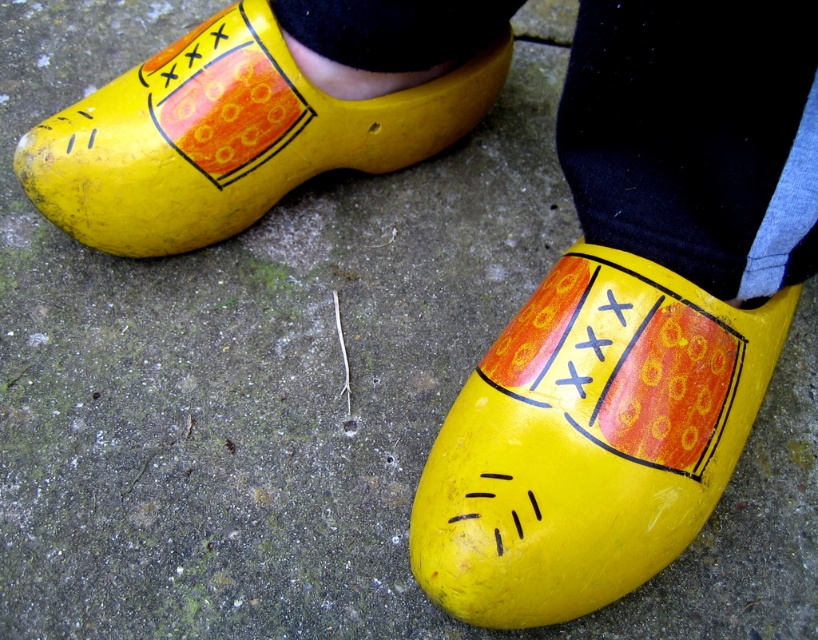
Question: Which object appears farthest from the camera in this image?

Choices:
 (A) yellow painted wood shoe at left
 (B) yellow painted wood shoe at lower right

Answer: (A)

Question: Can you confirm if yellow painted wood shoe at lower right is smaller than yellow painted wood shoe at left?

Choices:
 (A) no
 (B) yes

Answer: (A)

Question: Which point is farther to the camera?

Choices:
 (A) (691, 513)
 (B) (227, 166)

Answer: (B)

Question: Can you confirm if yellow painted wood shoe at lower right is thinner than yellow painted wood shoe at left?

Choices:
 (A) yes
 (B) no

Answer: (A)

Question: Is yellow painted wood shoe at lower right wider than yellow painted wood shoe at left?

Choices:
 (A) no
 (B) yes

Answer: (A)